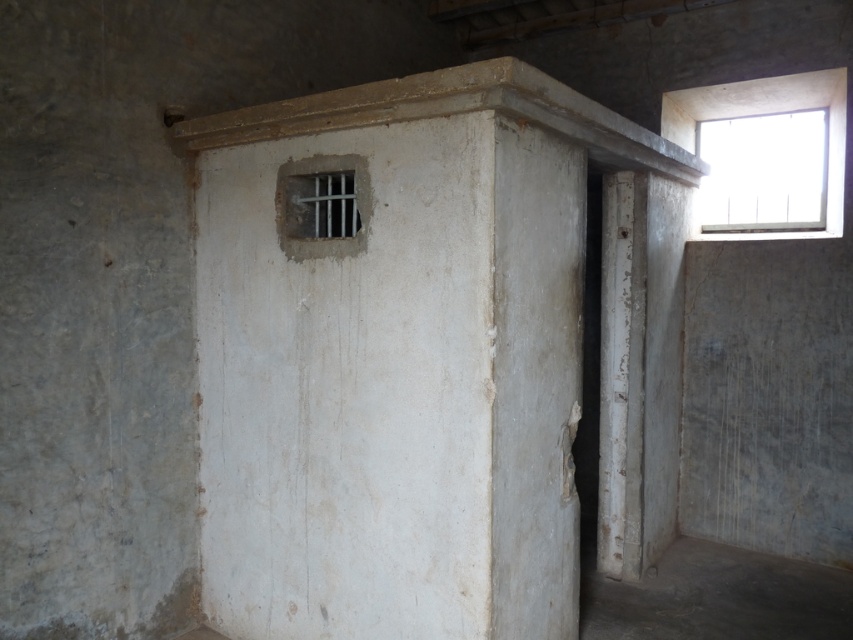
Question: Does clear glass window at upper right lie behind metallic bars at center?

Choices:
 (A) no
 (B) yes

Answer: (B)

Question: Which of the following is the farthest from the observer?

Choices:
 (A) metallic bars at center
 (B) clear glass window at upper right

Answer: (B)

Question: Can you confirm if clear glass window at upper right is thinner than metallic bars at center?

Choices:
 (A) yes
 (B) no

Answer: (B)

Question: Which object is farther from the camera taking this photo?

Choices:
 (A) metallic bars at center
 (B) clear glass window at upper right

Answer: (B)

Question: Which point appears closest to the camera in this image?

Choices:
 (A) tap(790, 112)
 (B) tap(341, 176)

Answer: (B)

Question: Is clear glass window at upper right thinner than metallic bars at center?

Choices:
 (A) yes
 (B) no

Answer: (B)